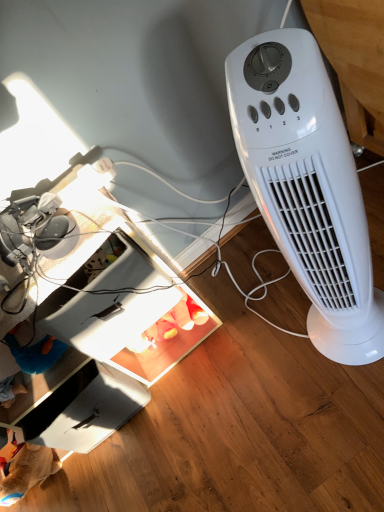
The image size is (384, 512). I want to click on free spot in front of white plastic computer desk at lower left, so click(193, 462).